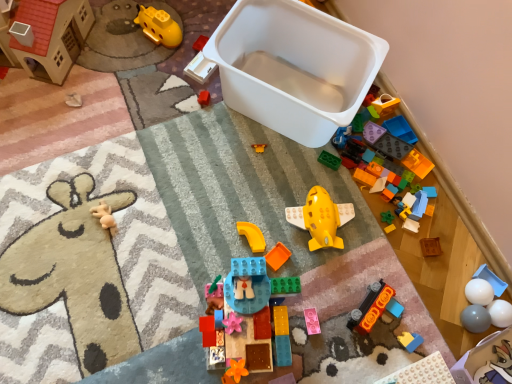
Where is `vacant space in front of matte plastic toy at lower right, which is counted as the 12th toy, starting from the left`? Image resolution: width=512 pixels, height=384 pixels. vacant space in front of matte plastic toy at lower right, which is counted as the 12th toy, starting from the left is located at coordinates (402, 371).